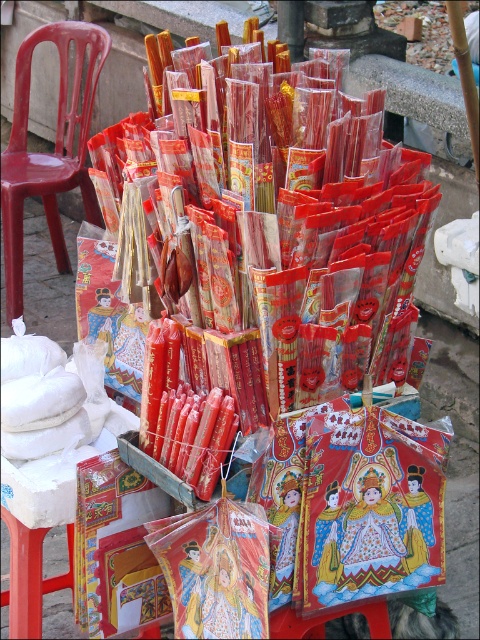
Question: Is matte red incense sticks at center to the left of matte plastic chair at left from the viewer's perspective?

Choices:
 (A) no
 (B) yes

Answer: (A)

Question: Is matte red incense sticks at center bigger than matte plastic chair at left?

Choices:
 (A) no
 (B) yes

Answer: (A)

Question: Among these points, which one is nearest to the camera?

Choices:
 (A) (191, 248)
 (B) (23, 193)

Answer: (A)

Question: Does matte red incense sticks at center appear on the right side of matte plastic chair at left?

Choices:
 (A) no
 (B) yes

Answer: (B)